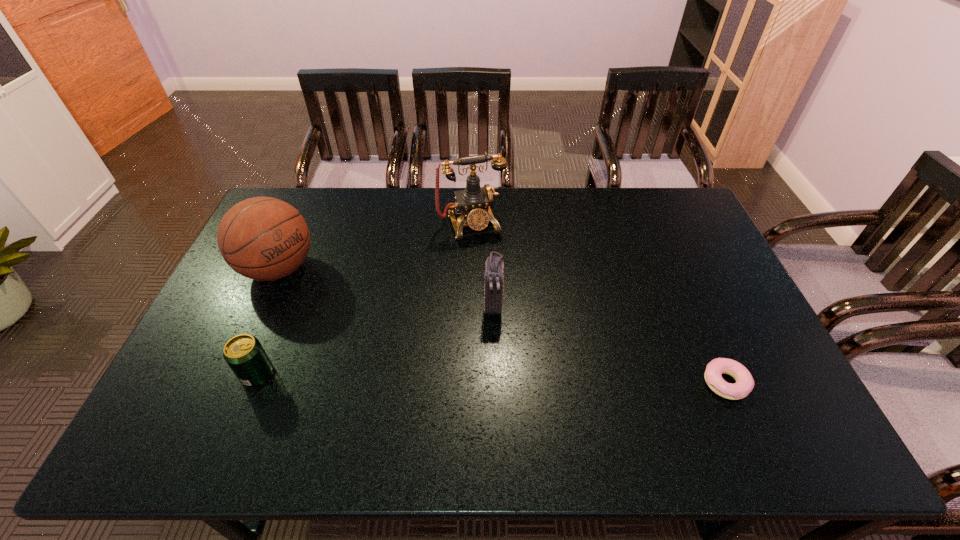
Find the location of a particular element. free space between the telephone and the third tallest object is located at coordinates (482, 265).

Find the location of a particular element. This screenshot has height=540, width=960. object that is the third closest one to the rightmost object is located at coordinates (244, 354).

Identify which object is located as the second nearest to the telephone. Please provide its 2D coordinates. Your answer should be formatted as a tuple, i.e. [(x, y)], where the tuple contains the x and y coordinates of a point satisfying the conditions above.

[(262, 238)]

Find the location of `free location that satisfies the following two spatial constraints: 1. on the front side of the basketball; 2. on the right side of the fourth tallest object`. free location that satisfies the following two spatial constraints: 1. on the front side of the basketball; 2. on the right side of the fourth tallest object is located at coordinates (231, 374).

Locate an element on the screen. vacant point that satisfies the following two spatial constraints: 1. on the front side of the telephone; 2. on the right side of the shortest object is located at coordinates (468, 383).

Where is `free spot that satisfies the following two spatial constraints: 1. on the front side of the shortest object; 2. on the right side of the beer can`? free spot that satisfies the following two spatial constraints: 1. on the front side of the shortest object; 2. on the right side of the beer can is located at coordinates (254, 383).

The height and width of the screenshot is (540, 960). I want to click on vacant space that satisfies the following two spatial constraints: 1. on the back side of the telephone; 2. on the right side of the basketball, so click(299, 224).